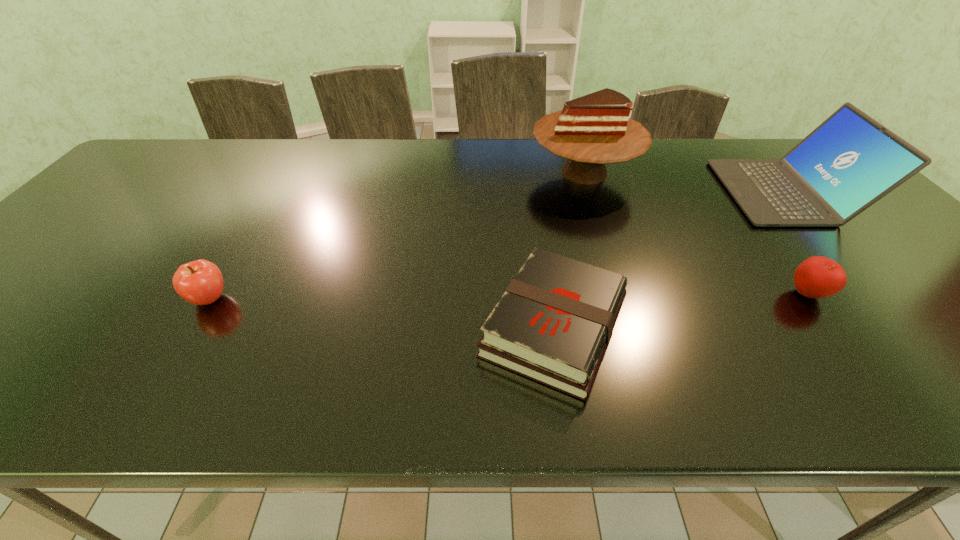
Locate an element on the screen. This screenshot has height=540, width=960. free location located on the right of the leftmost object is located at coordinates 261,299.

Find the location of a particular element. The image size is (960, 540). vacant space located on the right of the right apple is located at coordinates (886, 294).

Find the location of a particular element. This screenshot has width=960, height=540. vacant point located 0.270m on the back of the shortest object is located at coordinates (536, 204).

What are the coordinates of `cake that is at the far edge` in the screenshot? It's located at (593, 130).

In order to click on laptop computer at the far edge in this screenshot , I will do `click(850, 161)`.

Locate an element on the screen. object situated at the near edge is located at coordinates (553, 324).

Where is `object that is at the right edge`? The image size is (960, 540). object that is at the right edge is located at coordinates (850, 161).

At what (x,y) coordinates should I click in order to perform the action: click on object that is at the far right corner. Please return your answer as a coordinate pair (x, y). The height and width of the screenshot is (540, 960). Looking at the image, I should click on (850, 161).

Image resolution: width=960 pixels, height=540 pixels. In the image, there is a desktop. In order to click on vacant area at the far edge in this screenshot , I will do `click(352, 163)`.

I want to click on vacant space at the left edge of the desktop, so click(104, 218).